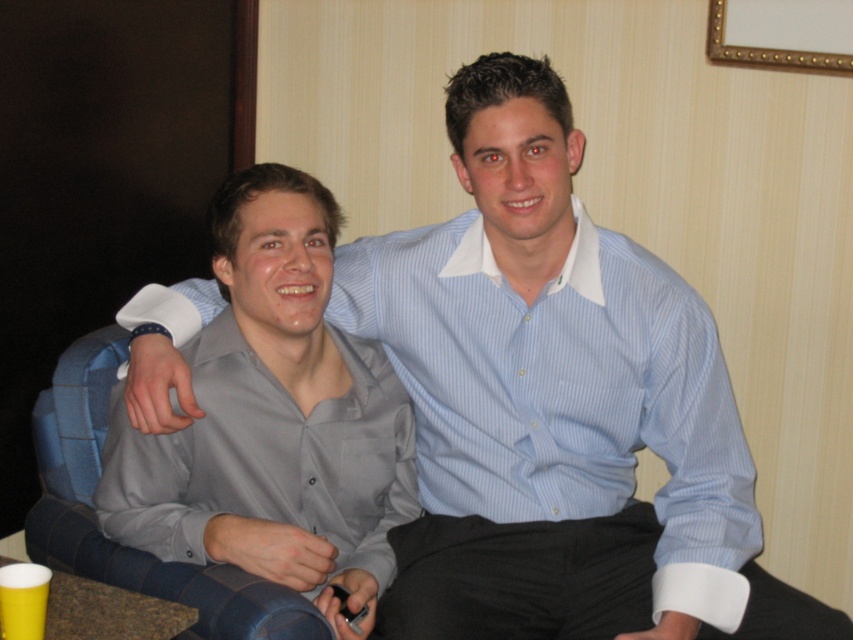
Who is positioned more to the right, matte gray shirt at center or gold metallic picture frame at upper right?

From the viewer's perspective, gold metallic picture frame at upper right appears more on the right side.

This screenshot has height=640, width=853. Describe the element at coordinates (274, 419) in the screenshot. I see `matte gray shirt at center` at that location.

The image size is (853, 640). What are the coordinates of `matte gray shirt at center` in the screenshot? It's located at (274, 419).

Where is `matte gray shirt at center`? This screenshot has height=640, width=853. matte gray shirt at center is located at coordinates (274, 419).